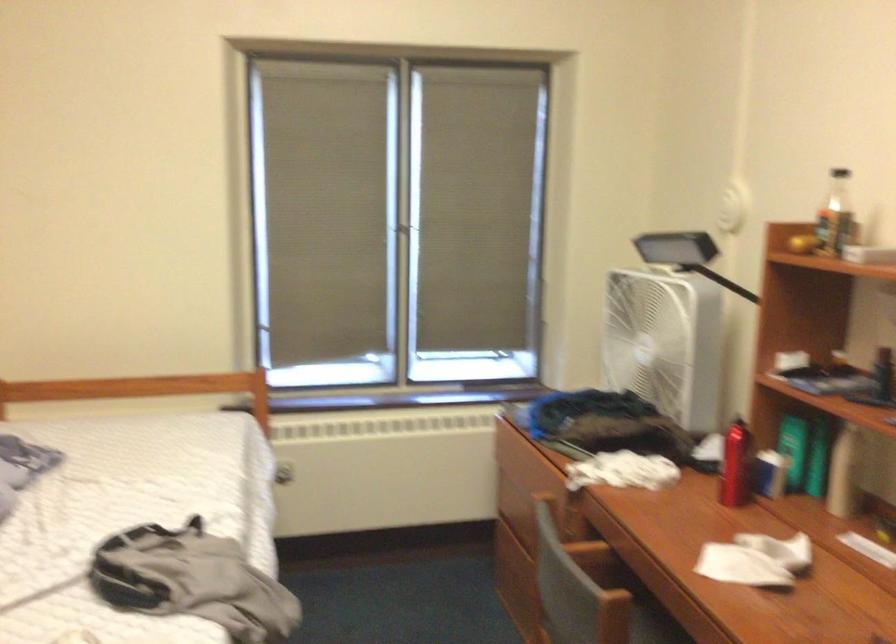
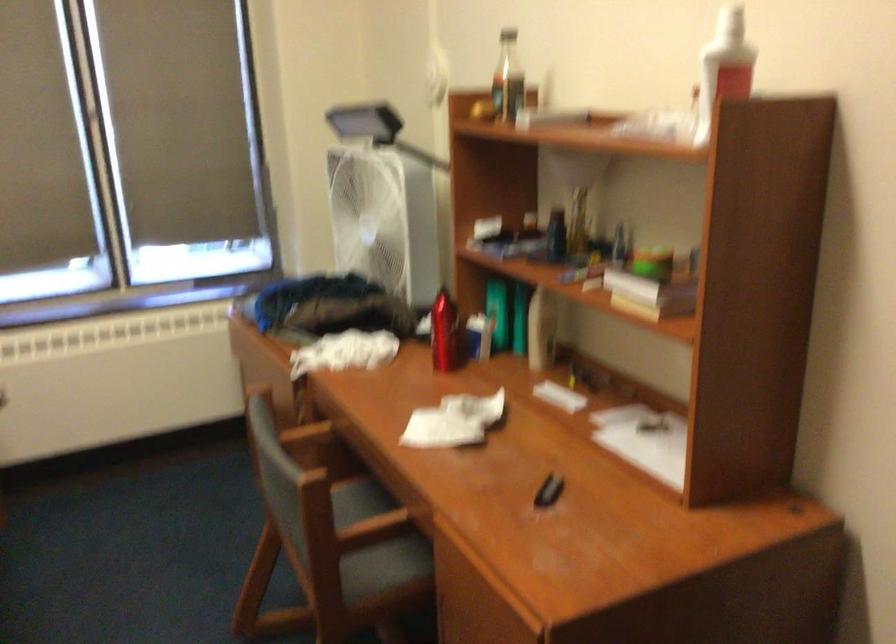
In the second image, find the point that corresponds to (x=737, y=464) in the first image.

(444, 333)